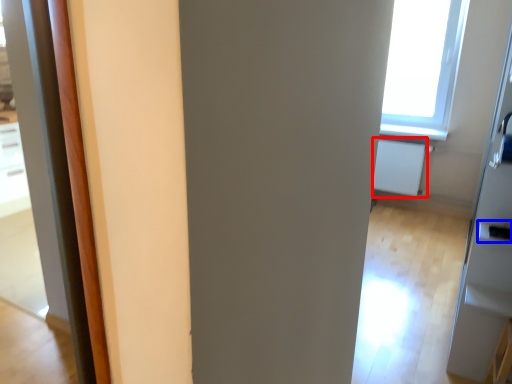
Question: Among these objects, which one is nearest to the camera, radiator (highlighted by a red box) or door handle (highlighted by a blue box)?

Choices:
 (A) radiator
 (B) door handle

Answer: (B)